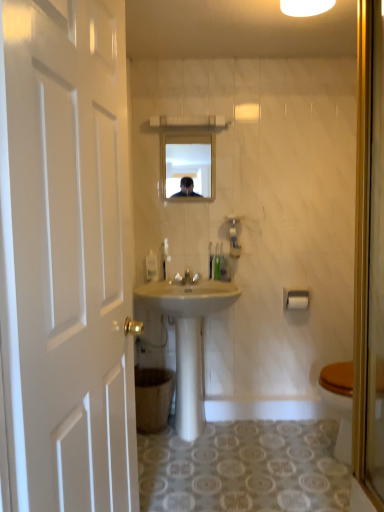
In order to face white glossy faucet at center, should I rotate leftwards or rightwards?

You should rotate left by 0.784 degrees.

What is the approximate height of white glossy faucet at center?

3.66 inches.

What do you see at coordinates (305, 7) in the screenshot? This screenshot has width=384, height=512. I see `white glossy light fixture at upper center` at bounding box center [305, 7].

Identify the location of translucent plastic soap dispenser at center, the 1th toiletries when ordered from right to left. (217, 262).

This screenshot has width=384, height=512. Describe the element at coordinates (188, 167) in the screenshot. I see `matte glass mirror at upper center` at that location.

This screenshot has height=512, width=384. Identify the location of white glossy faucet at center. point(189,278).

I want to click on trash bin/can that appears below the translucent plastic toothbrushes at center, positioned as the first toiletries in left-to-right order (from the image's perspective), so click(x=153, y=398).

Is translucent plastic toothbrushes at center, which is the 3th toiletries from right to left, positioned beyond the bounds of brown cardboard trash bin/can at lower left?

translucent plastic toothbrushes at center, which is the 3th toiletries from right to left, lies outside brown cardboard trash bin/can at lower left's area.

Between translucent plastic toothbrushes at center, which is the 3th toiletries from right to left, and brown cardboard trash bin/can at lower left, which one has less height?

Standing shorter between the two is translucent plastic toothbrushes at center, which is the 3th toiletries from right to left.

From a real-world perspective, is translucent plastic toothbrushes at center, positioned as the first toiletries in left-to-right order, positioned above or below brown cardboard trash bin/can at lower left?

translucent plastic toothbrushes at center, positioned as the first toiletries in left-to-right order, is situated higher than brown cardboard trash bin/can at lower left in the real world.

Is green plastic toothbrushes at center, which is counted as the second toiletries, starting from the right, surrounded by white glossy faucet at center?

No, green plastic toothbrushes at center, which is counted as the second toiletries, starting from the right, is not a part of white glossy faucet at center.

Is white glossy faucet at center taller than green plastic toothbrushes at center, the 2th toiletries from the left?

Incorrect, the height of white glossy faucet at center is not larger of that of green plastic toothbrushes at center, the 2th toiletries from the left.

Considering the sizes of white glossy faucet at center and green plastic toothbrushes at center, which is counted as the second toiletries, starting from the right, in the image, is white glossy faucet at center bigger or smaller than green plastic toothbrushes at center, which is counted as the second toiletries, starting from the right,?

Considering their sizes, white glossy faucet at center takes up more space than green plastic toothbrushes at center, which is counted as the second toiletries, starting from the right.

Which is behind, point (185, 278) or point (211, 251)?

The point (211, 251) is farther from the camera.

From the image's perspective, is green plastic toothbrushes at center, the 2th toiletries from the left, located beneath brown cardboard trash bin/can at lower left?

No, from the image's perspective, green plastic toothbrushes at center, the 2th toiletries from the left, is not below brown cardboard trash bin/can at lower left.

Which of these two, green plastic toothbrushes at center, the 2th toiletries from the left, or brown cardboard trash bin/can at lower left, stands shorter?

green plastic toothbrushes at center, the 2th toiletries from the left, is shorter.

Is green plastic toothbrushes at center, which is counted as the second toiletries, starting from the right, positioned beyond the bounds of brown cardboard trash bin/can at lower left?

Yes, green plastic toothbrushes at center, which is counted as the second toiletries, starting from the right, is outside of brown cardboard trash bin/can at lower left.

From a real-world perspective, is green plastic toothbrushes at center, which is counted as the second toiletries, starting from the right, below brown cardboard trash bin/can at lower left?

Incorrect, from a real-world perspective, green plastic toothbrushes at center, which is counted as the second toiletries, starting from the right, is higher than brown cardboard trash bin/can at lower left.

Considering the sizes of brown cardboard trash bin/can at lower left and white wooden door at left in the image, is brown cardboard trash bin/can at lower left wider or thinner than white wooden door at left?

Considering their sizes, brown cardboard trash bin/can at lower left looks broader than white wooden door at left.

Is brown cardboard trash bin/can at lower left placed right next to white wooden door at left?

No, brown cardboard trash bin/can at lower left is not making contact with white wooden door at left.

Considering the positions of objects brown cardboard trash bin/can at lower left and white wooden door at left in the image provided, who is more to the right, brown cardboard trash bin/can at lower left or white wooden door at left?

brown cardboard trash bin/can at lower left.

From a real-world perspective, is brown cardboard trash bin/can at lower left positioned above or below white wooden door at left?

In terms of real-world spatial position, brown cardboard trash bin/can at lower left is below white wooden door at left.

Which of these two, white glossy light fixture at upper center or translucent plastic soap dispenser at center, the 1th toiletries when ordered from right to left, is thinner?

With smaller width is translucent plastic soap dispenser at center, the 1th toiletries when ordered from right to left.

Is white glossy light fixture at upper center further to the viewer compared to translucent plastic soap dispenser at center, the 1th toiletries when ordered from right to left?

No, white glossy light fixture at upper center is closer to the camera.

Could you measure the distance between white glossy light fixture at upper center and translucent plastic soap dispenser at center, which is the 3th toiletries from left to right?

A distance of 1.32 meters exists between white glossy light fixture at upper center and translucent plastic soap dispenser at center, which is the 3th toiletries from left to right.

From a real-world perspective, is white glossy light fixture at upper center physically located above or below translucent plastic soap dispenser at center, the 1th toiletries when ordered from right to left?

Clearly, from a real-world perspective, white glossy light fixture at upper center is above translucent plastic soap dispenser at center, the 1th toiletries when ordered from right to left.

From the picture: Visually, is brown cardboard trash bin/can at lower left positioned to the left or to the right of translucent plastic soap dispenser at center, which is the 3th toiletries from left to right?

Clearly, brown cardboard trash bin/can at lower left is on the left of translucent plastic soap dispenser at center, which is the 3th toiletries from left to right, in the image.

Considering the positions of point (148, 430) and point (219, 275), is point (148, 430) closer or farther from the camera than point (219, 275)?

Point (148, 430) is closer to the camera than point (219, 275).

Considering the sizes of brown cardboard trash bin/can at lower left and translucent plastic soap dispenser at center, which is the 3th toiletries from left to right, in the image, is brown cardboard trash bin/can at lower left wider or thinner than translucent plastic soap dispenser at center, which is the 3th toiletries from left to right,?

brown cardboard trash bin/can at lower left is wider than translucent plastic soap dispenser at center, which is the 3th toiletries from left to right.

Is translucent plastic soap dispenser at center, which is the 3th toiletries from left to right, a part of brown cardboard trash bin/can at lower left?

No.

In the scene shown: Does white plastic towel bar at upper right have a smaller size compared to translucent plastic soap dispenser at center, which is the 3th toiletries from left to right?

No, white plastic towel bar at upper right is not smaller than translucent plastic soap dispenser at center, which is the 3th toiletries from left to right.

Which object is closer to the camera taking this photo, white plastic towel bar at upper right or translucent plastic soap dispenser at center, which is the 3th toiletries from left to right?

white plastic towel bar at upper right.

Can you confirm if white plastic towel bar at upper right is positioned to the right of translucent plastic soap dispenser at center, the 1th toiletries when ordered from right to left?

Correct, you'll find white plastic towel bar at upper right to the right of translucent plastic soap dispenser at center, the 1th toiletries when ordered from right to left.

How many degrees apart are the facing directions of white plastic towel bar at upper right and translucent plastic soap dispenser at center, which is the 3th toiletries from left to right?

white plastic towel bar at upper right and translucent plastic soap dispenser at center, which is the 3th toiletries from left to right, are facing 0.502 degrees away from each other.

Find the location of a particular element. This screenshot has height=512, width=384. trash bin/can on the right of translucent plastic toothbrushes at center, positioned as the first toiletries in left-to-right order is located at coordinates (153, 398).

Where is `faucet to the left of green plastic toothbrushes at center, the 2th toiletries from the left`? The width and height of the screenshot is (384, 512). faucet to the left of green plastic toothbrushes at center, the 2th toiletries from the left is located at coordinates (189, 278).

Estimate the real-world distances between objects in this image. Which object is further from translucent plastic soap dispenser at center, the 1th toiletries when ordered from right to left, green plastic toothbrushes at center, the 2th toiletries from the left, or white glossy light fixture at upper center?

Among the two, white glossy light fixture at upper center is located further to translucent plastic soap dispenser at center, the 1th toiletries when ordered from right to left.

Estimate the real-world distances between objects in this image. Which object is further from matte glass mirror at upper center, brown cardboard trash bin/can at lower left or white wooden door at left?

white wooden door at left.

Looking at the image, which one is located further to white plastic towel bar at upper right, white glossy light fixture at upper center or white glossy faucet at center?

Among the two, white glossy light fixture at upper center is located further to white plastic towel bar at upper right.

Based on the photo, looking at the image, which one is located further to white matte toilet paper at lower right, white wooden door at left or white plastic towel bar at upper right?

Among the two, white wooden door at left is located further to white matte toilet paper at lower right.

Based on the photo, from the image, which object appears to be nearer to white glossy faucet at center, white plastic towel bar at upper right or matte glass mirror at upper center?

white plastic towel bar at upper right is closer to white glossy faucet at center.

When comparing their distances from white plastic towel bar at upper right, does white glossy sink at center or white matte toilet paper at lower right seem closer?

white matte toilet paper at lower right is positioned closer to the anchor white plastic towel bar at upper right.

From the image, which object appears to be nearer to translucent plastic soap dispenser at center, which is the 3th toiletries from left to right, white glossy faucet at center or matte glass mirror at upper center?

Based on the image, white glossy faucet at center appears to be nearer to translucent plastic soap dispenser at center, which is the 3th toiletries from left to right.

Considering their positions, is white wooden door at left positioned further to matte glass mirror at upper center than translucent plastic toothbrushes at center, which is the 3th toiletries from right to left?

white wooden door at left is further to matte glass mirror at upper center.

The image size is (384, 512). Identify the location of towel bar between white glossy faucet at center and white matte toilet paper at lower right from left to right. (296, 298).

Where is `sink between white wooden door at left and white plastic towel bar at upper right along the z-axis`? The image size is (384, 512). sink between white wooden door at left and white plastic towel bar at upper right along the z-axis is located at coordinates (188, 340).

What are the coordinates of `toilet paper that lies between white glossy light fixture at upper center and white glossy sink at center from top to bottom` in the screenshot? It's located at [297, 302].

The image size is (384, 512). Find the location of `faucet that lies between white glossy light fixture at upper center and white matte toilet paper at lower right from top to bottom`. faucet that lies between white glossy light fixture at upper center and white matte toilet paper at lower right from top to bottom is located at coordinates (189, 278).